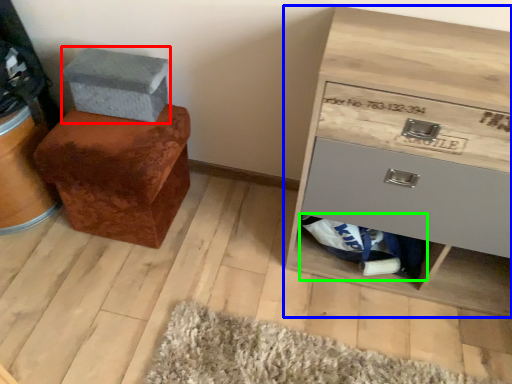
Question: Based on their relative distances, which object is farther from shoe box (highlighted by a red box)? Choose from chest of drawers (highlighted by a blue box) and material (highlighted by a green box).

Choices:
 (A) chest of drawers
 (B) material

Answer: (B)